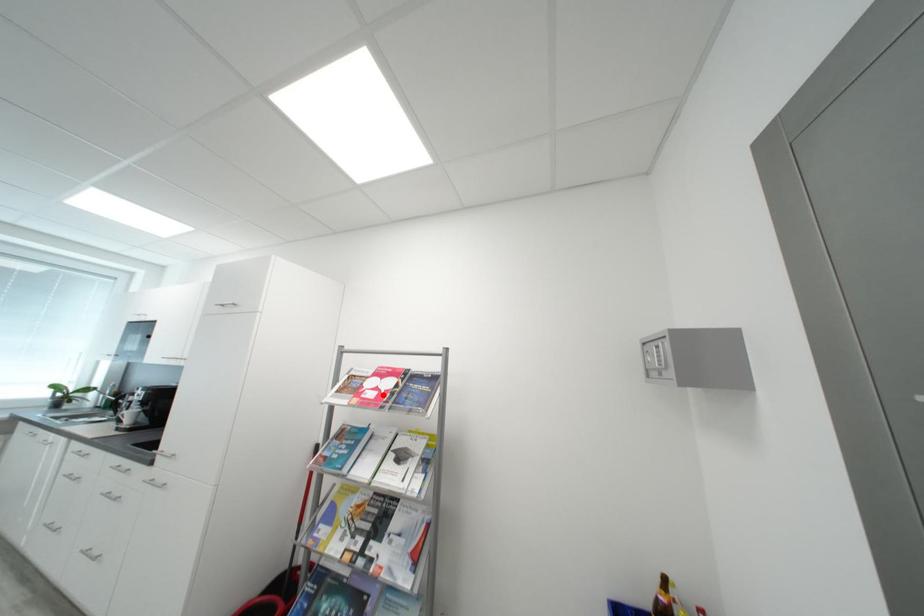
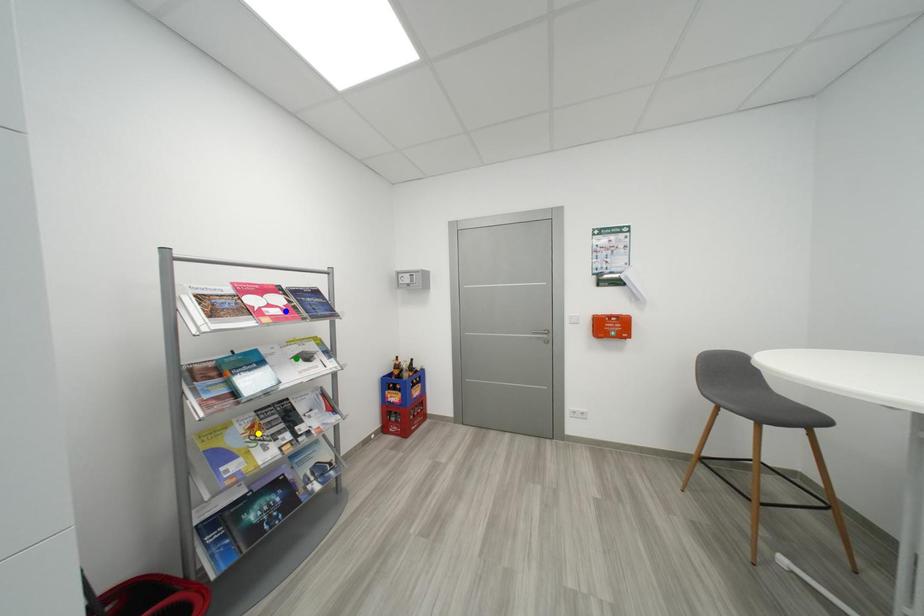
Question: I am providing you with two images of the same scene from different viewpoints. A red point is marked on the first image. You are given multiple points on the second image. Which spot in image 2 lines up with the point in image 1?

Choices:
 (A) green point
 (B) blue point
 (C) yellow point

Answer: (B)